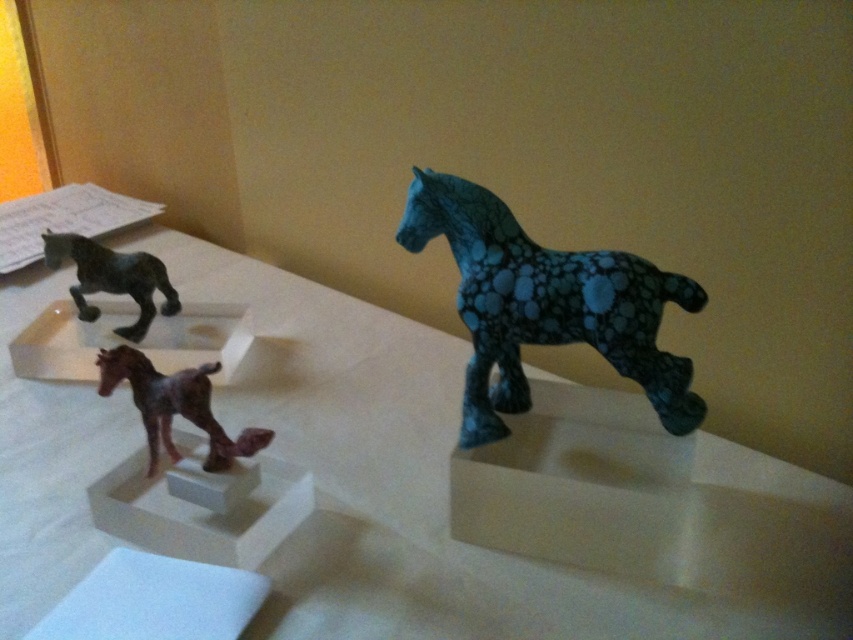
You are standing in front of the display and want to pick up the brown matte horse at lower left and the matte black horse at left. Which one do you need to reach further to grab?

The matte black horse at left is further away from you than the brown matte horse at lower left, so you need to reach further to grab the matte black horse at left.

You are standing in front of the white plastic table at center. The table is 36.84 inches away from you. If you want to place a book that is 12 inches long on the table, will it fit entirely on the table?

The distance of white plastic table at center from viewer is 36.84 inches. The book is 12 inches long, so it will fit entirely on the table since the table is longer than the book.